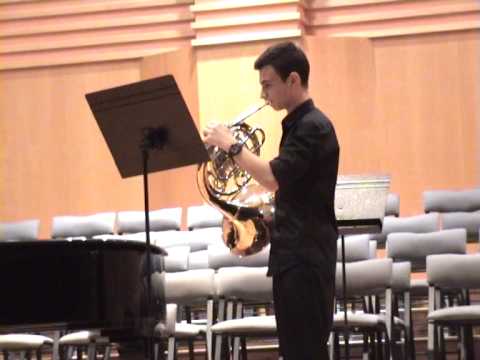
Identify the location of second music stand. The height and width of the screenshot is (360, 480). (365, 209).